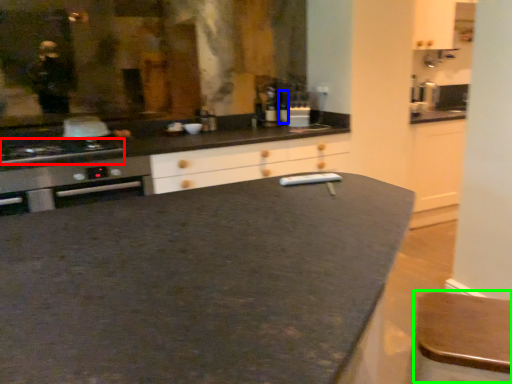
Question: Based on their relative distances, which object is nearer to kitchen appliance (highlighted by a red box)? Choose from bottle (highlighted by a blue box) and bar stool (highlighted by a green box).

Choices:
 (A) bottle
 (B) bar stool

Answer: (A)